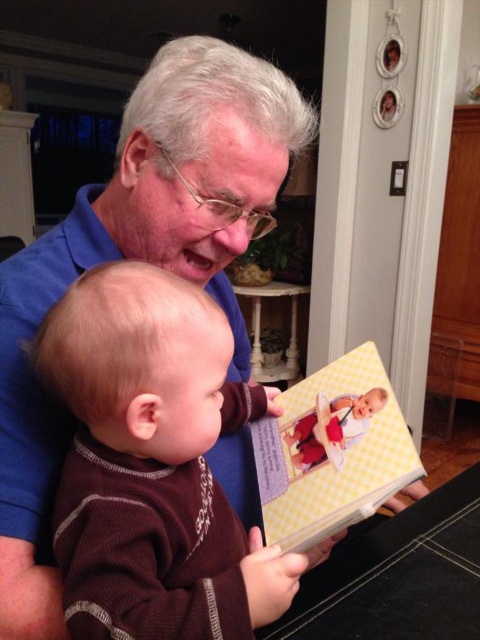
You are a photographer trying to capture a closeup of the yellow checkered book at center while ensuring the blue smooth shirt at upper left doesn t block the view. Based on their sizes, which object should you focus on to avoid obstruction?

The blue smooth shirt at upper left is larger in size than the yellow checkered book at center, so focusing on the yellow checkered book at center while positioning the camera to avoid the larger blue smooth shirt at upper left would prevent obstruction.

You are a photographer taking a picture of the blue smooth shirt at upper left and the yellow checkered book at center. Which object should you focus on first if you want to capture both in focus, considering their positions?

The blue smooth shirt at upper left is above the yellow checkered book at center, so focusing on the blue smooth shirt at upper left first would help ensure both are in focus as it is closer to the camera.